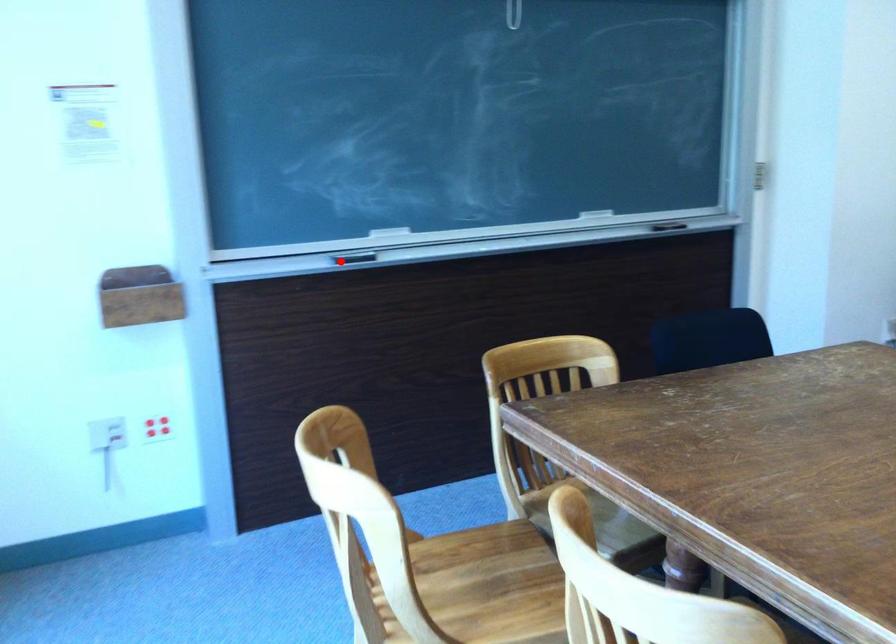
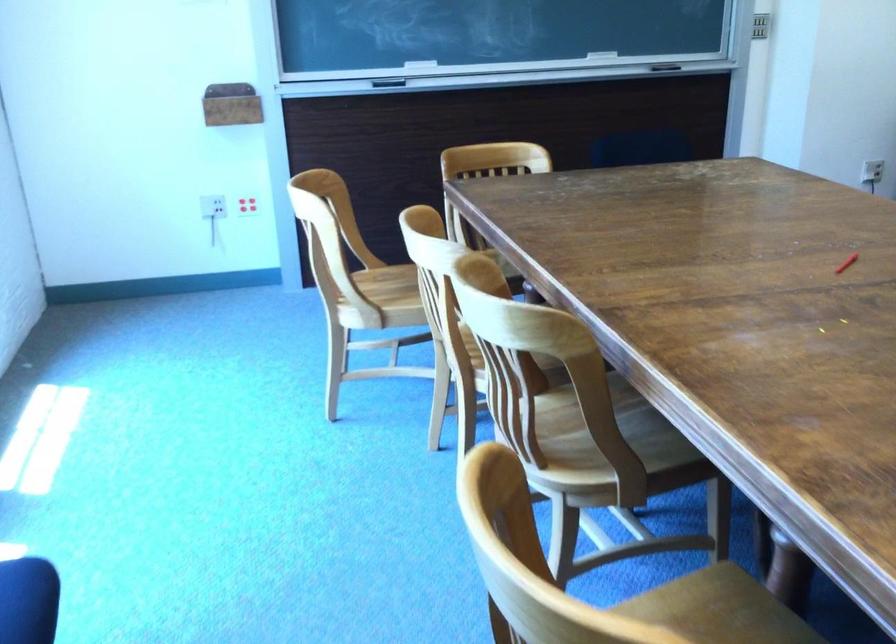
Where in the second image is the point corresponding to the highlighted location from the first image?

(389, 82)